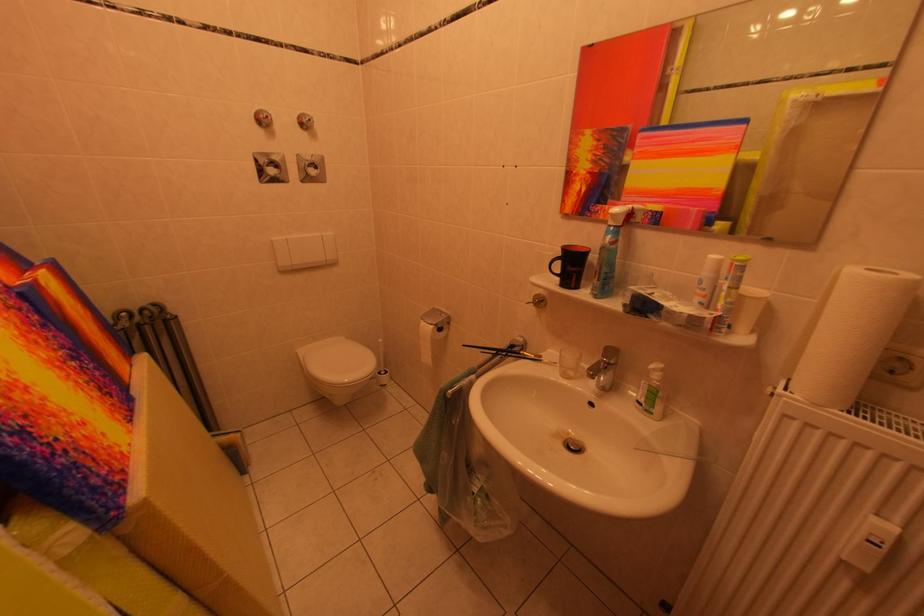
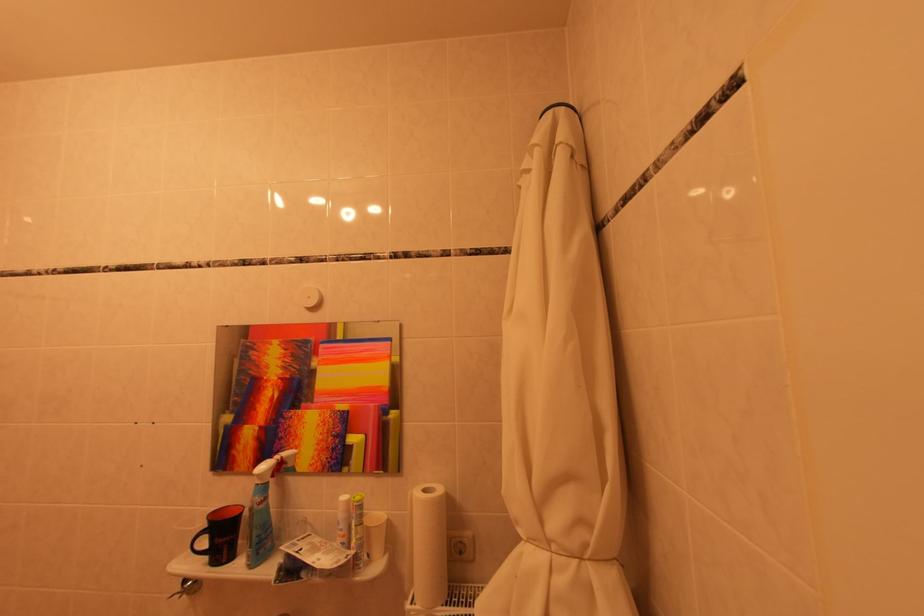
Where in the second image is the point corresponding to (x=641, y=212) from the first image?

(290, 461)